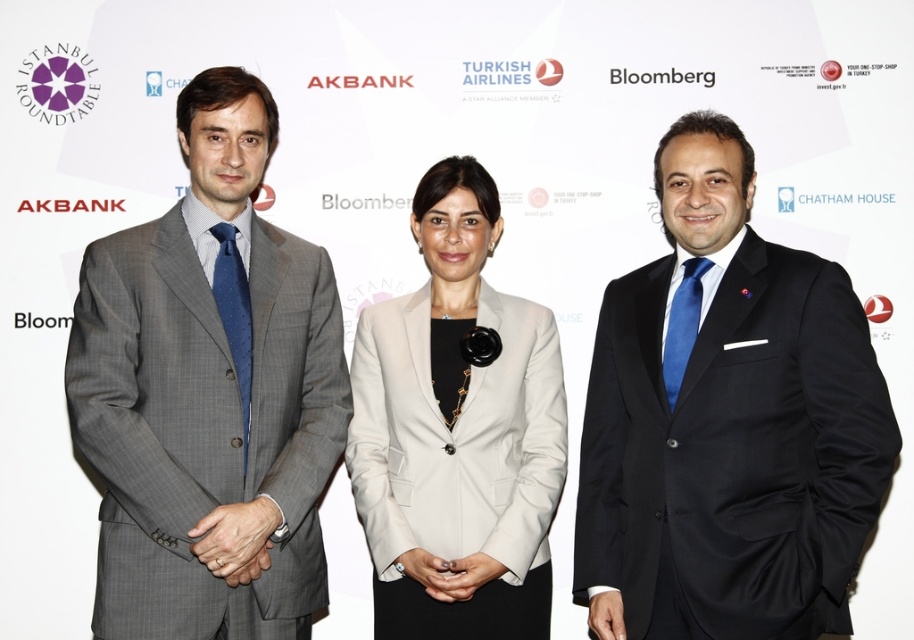
Question: Can you confirm if black satin suit at right is positioned below gray textured suit at left?

Choices:
 (A) yes
 (B) no

Answer: (A)

Question: Is black satin suit at right wider than light beige fabric blazer at center?

Choices:
 (A) no
 (B) yes

Answer: (B)

Question: Considering the real-world distances, which object is farthest from the black satin suit at right?

Choices:
 (A) light beige fabric blazer at center
 (B) gray textured suit at left

Answer: (B)

Question: Does black satin suit at right appear under light beige fabric blazer at center?

Choices:
 (A) no
 (B) yes

Answer: (A)

Question: Which object is positioned closest to the black satin suit at right?

Choices:
 (A) gray textured suit at left
 (B) light beige fabric blazer at center

Answer: (B)

Question: Which object is positioned closest to the gray textured suit at left?

Choices:
 (A) black satin suit at right
 (B) light beige fabric blazer at center

Answer: (B)